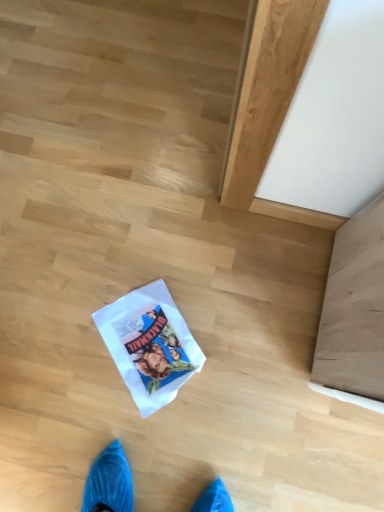
Find the location of `vacant region below white paper comic book at center (from a real-world perspective)`. vacant region below white paper comic book at center (from a real-world perspective) is located at coordinates (159, 346).